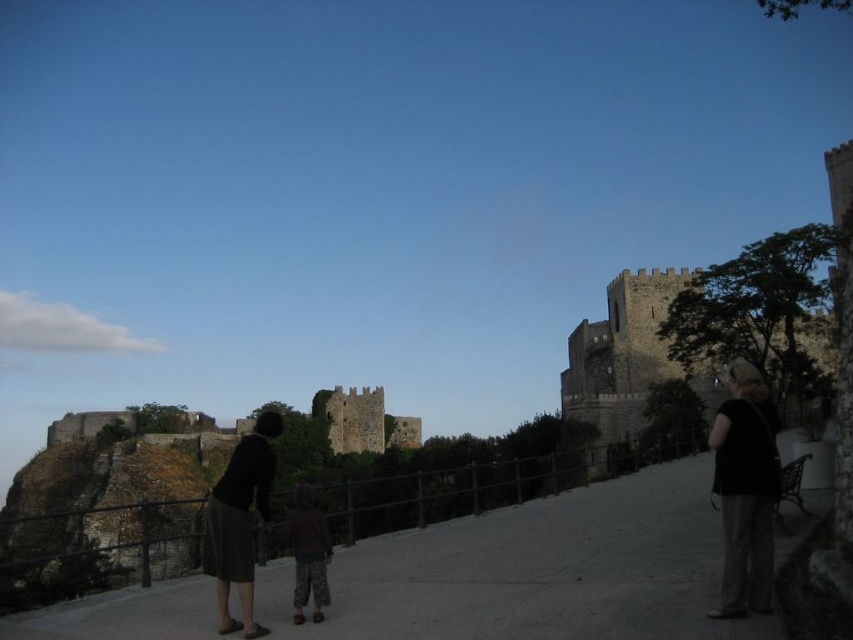
Question: Is dark stone castle at upper center smaller than black fabric at right?

Choices:
 (A) yes
 (B) no

Answer: (B)

Question: Which object is closer to the camera taking this photo?

Choices:
 (A) dark stone castle at upper center
 (B) dark gray skirt at lower center
 (C) camouflage pants at center

Answer: (B)

Question: Which object is positioned closest to the dark concrete path at center?

Choices:
 (A) dark stone castle at upper center
 (B) black fabric at right

Answer: (B)

Question: Can you confirm if dark gray skirt at lower center is bigger than camouflage pants at center?

Choices:
 (A) yes
 (B) no

Answer: (A)

Question: Does dark gray skirt at lower center have a smaller size compared to camouflage pants at center?

Choices:
 (A) no
 (B) yes

Answer: (A)

Question: Which object appears farthest from the camera in this image?

Choices:
 (A) dark concrete path at center
 (B) dark stone castle at upper center
 (C) dark gray skirt at lower center
 (D) camouflage pants at center

Answer: (B)